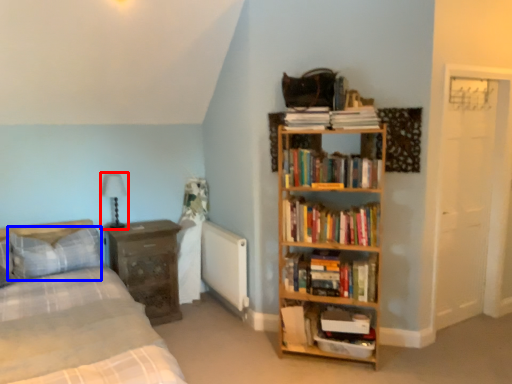
Question: Which object appears farthest to the camera in this image, table lamp (highlighted by a red box) or pillow (highlighted by a blue box)?

Choices:
 (A) table lamp
 (B) pillow

Answer: (A)